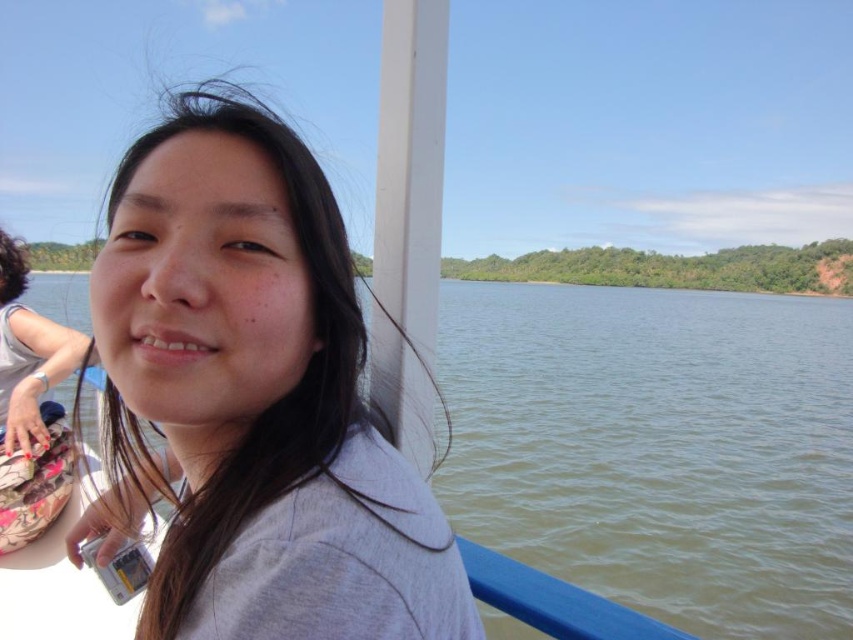
Question: Is gray matte shirt at upper left above green water at center?

Choices:
 (A) no
 (B) yes

Answer: (A)

Question: Is gray matte shirt at upper left to the right of green water at center from the viewer's perspective?

Choices:
 (A) no
 (B) yes

Answer: (A)

Question: Is gray matte shirt at upper left closer to the viewer compared to green water at center?

Choices:
 (A) yes
 (B) no

Answer: (A)

Question: Which object is farther from the camera taking this photo?

Choices:
 (A) green water at center
 (B) gray matte shirt at upper left

Answer: (A)